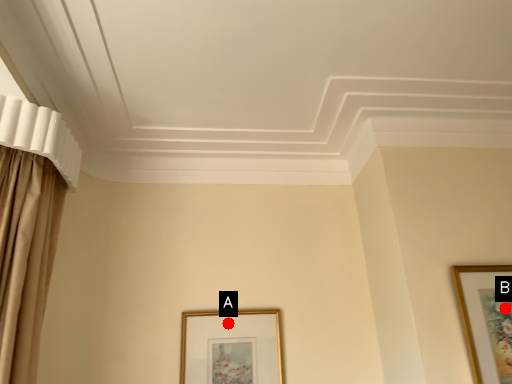
Question: Two points are circled on the image, labeled by A and B beside each circle. Which point appears closest to the camera in this image?

Choices:
 (A) A is closer
 (B) B is closer

Answer: (B)